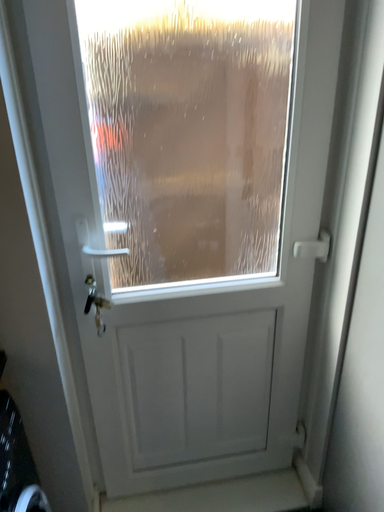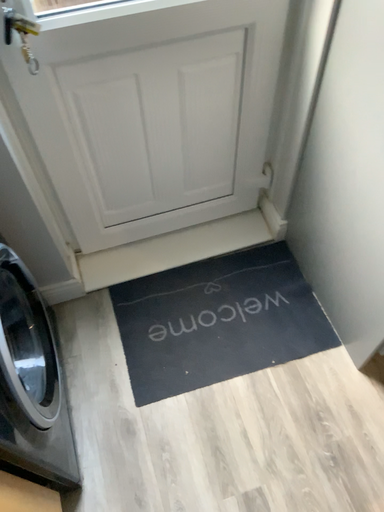
Question: Which way did the camera rotate in the video?

Choices:
 (A) rotated downward
 (B) rotated upward

Answer: (A)